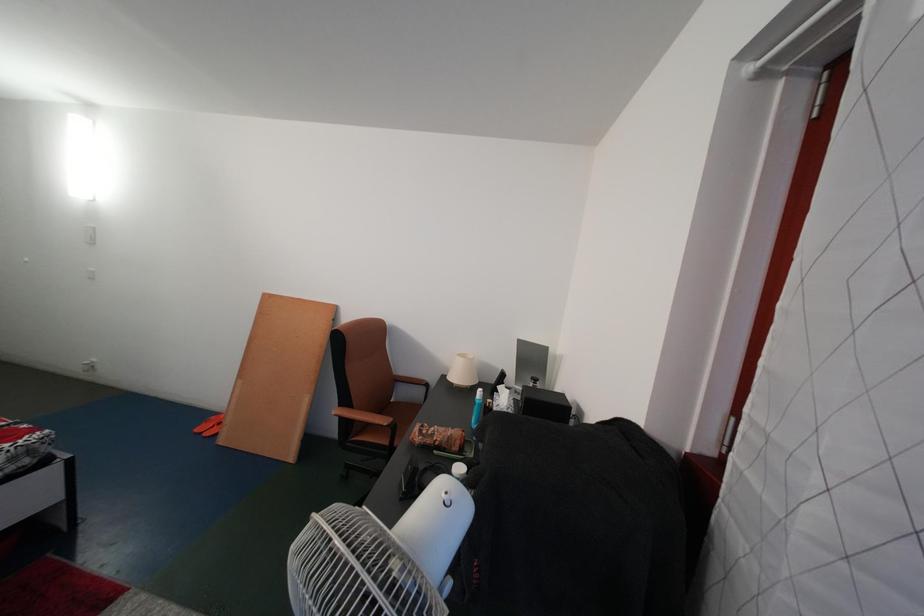
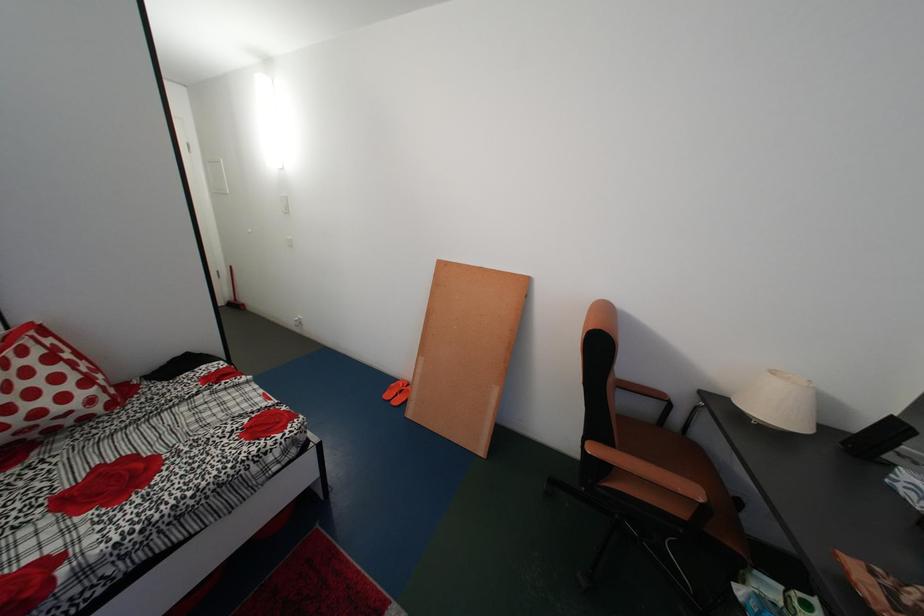
Question: The camera is either moving clockwise (left) or counter-clockwise (right) around the object. The first image is from the beginning of the video and the second image is from the end. Is the camera moving left or right when shooting the video?

Choices:
 (A) Left
 (B) Right

Answer: (B)